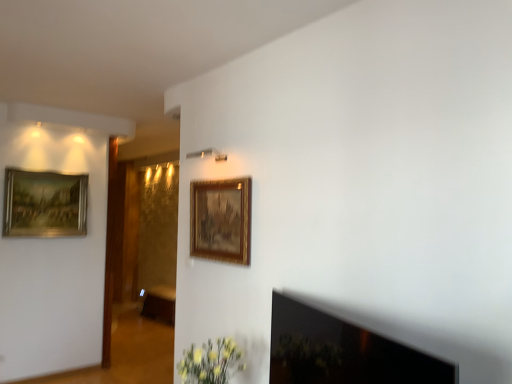
Question: Do you think gold-framed painting at upper left, the second picture frame viewed from the front, is within gold/gilded picture frame at upper center, which appears as the first picture frame when viewed from the right, or outside of it?

Choices:
 (A) outside
 (B) inside

Answer: (A)

Question: From the image's perspective, relative to gold/gilded picture frame at upper center, the second picture frame in the left-to-right sequence, is gold-framed painting at upper left, which is the 1th picture frame in left-to-right order, above or below?

Choices:
 (A) above
 (B) below

Answer: (A)

Question: Estimate the real-world distances between objects in this image. Which object is closer to the gold-framed painting at upper left, the 2th picture frame viewed from the right?

Choices:
 (A) brown wood cabinet at center
 (B) gold/gilded picture frame at upper center, the 2th picture frame from the back
 (C) black glass fireplace at lower right

Answer: (B)

Question: Which object is the closest to the black glass fireplace at lower right?

Choices:
 (A) brown wood cabinet at center
 (B) gold-framed painting at upper left, the 2th picture frame viewed from the right
 (C) gold/gilded picture frame at upper center, which appears as the first picture frame when viewed from the right

Answer: (C)